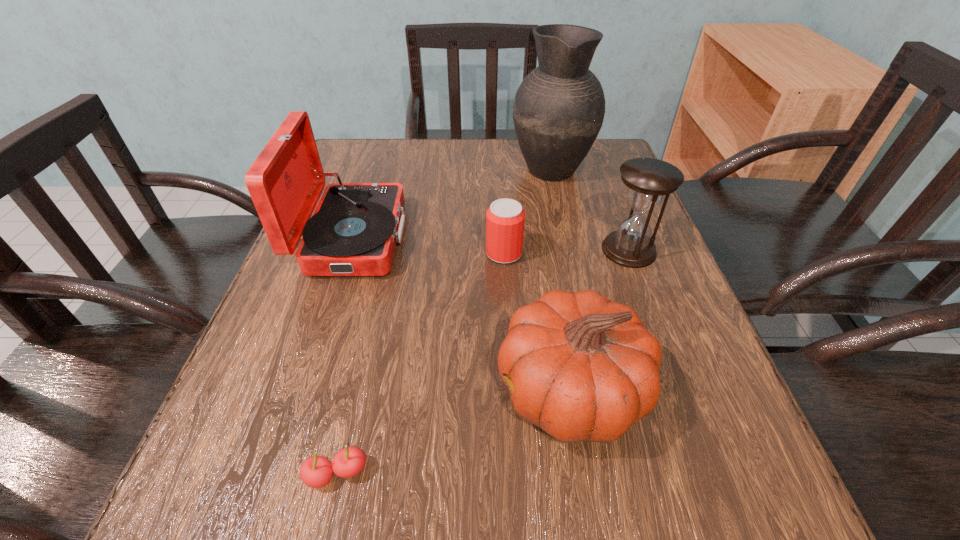
Image resolution: width=960 pixels, height=540 pixels. I want to click on free space that satisfies the following two spatial constraints: 1. on the front-facing side of the fifth shortest object; 2. on the right side of the fifth tallest object, so click(x=348, y=253).

At what (x,y) coordinates should I click in order to perform the action: click on vacant space that satisfies the following two spatial constraints: 1. on the front-facing side of the phonograph_record; 2. on the back side of the cherry. Please return your answer as a coordinate pair (x, y). Looking at the image, I should click on (276, 474).